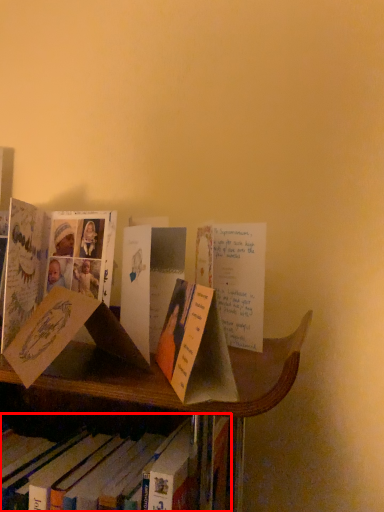
Question: Considering the relative positions of book (annotated by the red box) and book in the image provided, where is book (annotated by the red box) located with respect to the staircase?

Choices:
 (A) right
 (B) left

Answer: (B)